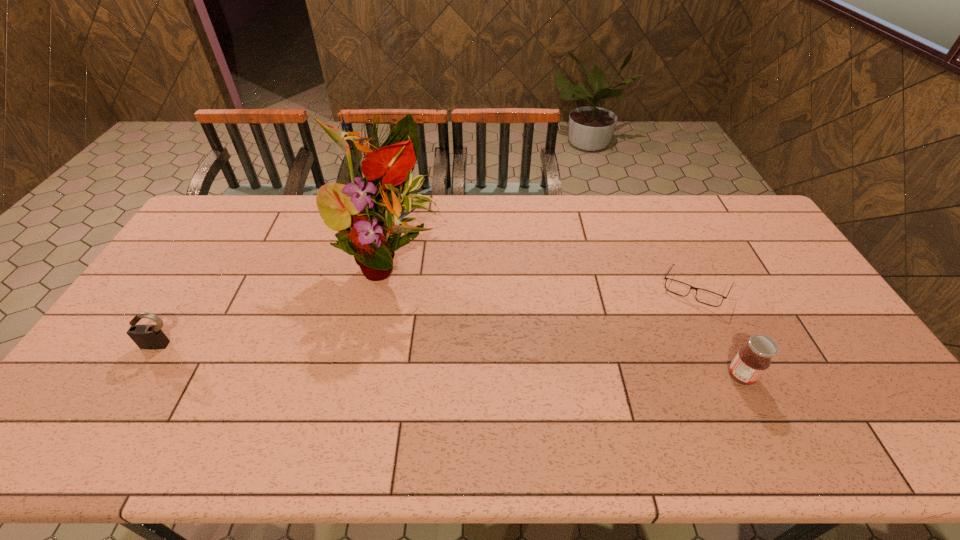
Locate an element on the screen. The width and height of the screenshot is (960, 540). vacant space at the right edge is located at coordinates (800, 333).

Where is `vacant area that lies between the jam and the third farthest object`? Image resolution: width=960 pixels, height=540 pixels. vacant area that lies between the jam and the third farthest object is located at coordinates (451, 360).

Find the location of `vacant region between the shortest object and the tallest object`. vacant region between the shortest object and the tallest object is located at coordinates (543, 274).

The width and height of the screenshot is (960, 540). I want to click on vacant region between the spectacles and the bouquet, so click(x=543, y=274).

Where is `free spot between the tallest object and the padlock`? The width and height of the screenshot is (960, 540). free spot between the tallest object and the padlock is located at coordinates (276, 301).

Identify the location of free area in between the tallest object and the nearest object. This screenshot has height=540, width=960. (566, 317).

Image resolution: width=960 pixels, height=540 pixels. What are the coordinates of `free point between the shortest object and the nearest object` in the screenshot? It's located at (718, 333).

This screenshot has height=540, width=960. I want to click on vacant space in between the shortest object and the tallest object, so click(x=543, y=274).

I want to click on empty space between the jam and the spectacles, so click(x=718, y=333).

You are a GUI agent. You are given a task and a screenshot of the screen. Output one action in this format:
    pyautogui.click(x=<x>, y=<y>)
    Task: Click on the unoccupied position between the shortest object and the tallest object
    The width and height of the screenshot is (960, 540).
    Given the screenshot: What is the action you would take?
    pyautogui.click(x=543, y=274)